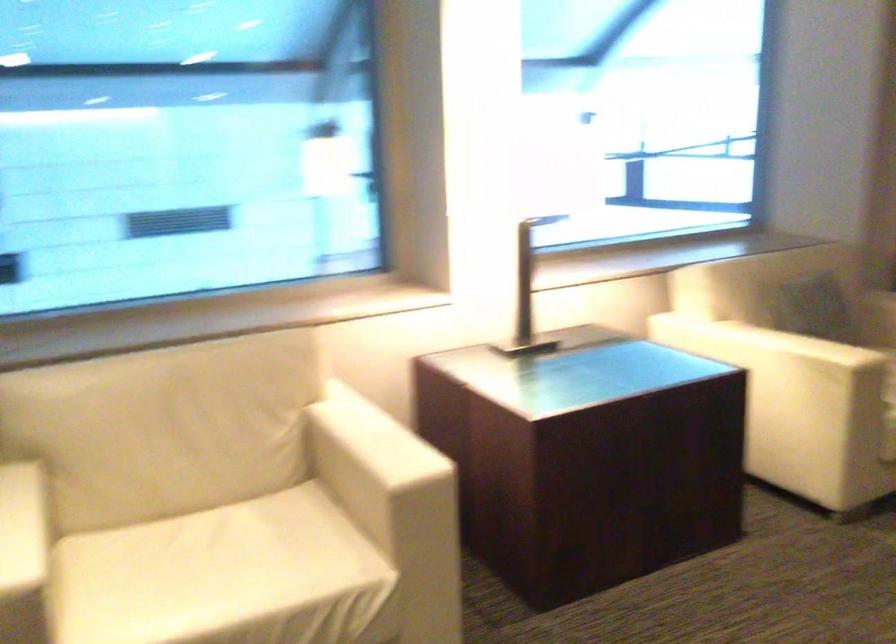
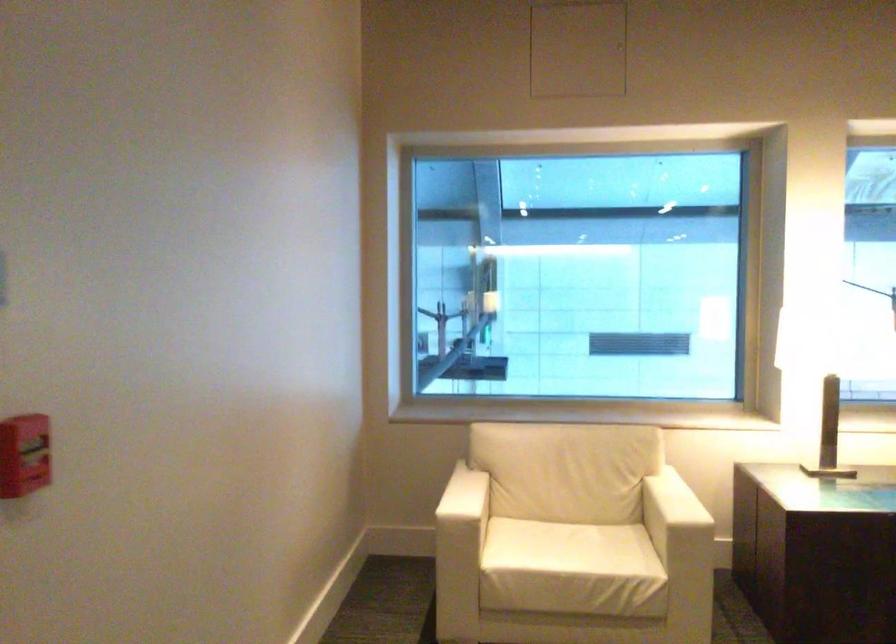
Find the pixel in the second image that matches (221,558) in the first image.

(566, 547)